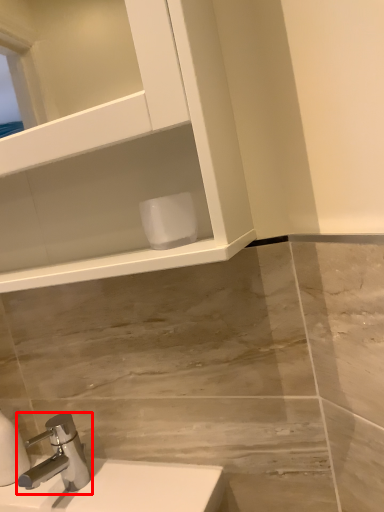
Question: Considering the relative positions of tap (annotated by the red box) and toilet paper in the image provided, where is tap (annotated by the red box) located with respect to the staircase?

Choices:
 (A) right
 (B) left

Answer: (B)